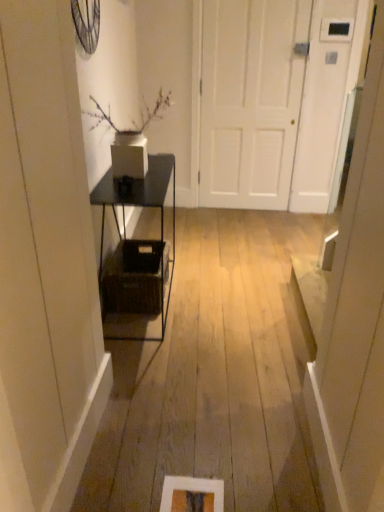
Describe the element at coordinates (250, 100) in the screenshot. I see `white matte door at center` at that location.

Image resolution: width=384 pixels, height=512 pixels. I want to click on black metal shelf at center, so pos(141,207).

From a real-world perspective, is brown woven basket at center located beneath white matte door at center?

Yes, from a real-world perspective, brown woven basket at center is under white matte door at center.

Is the position of brown woven basket at center more distant than that of white matte door at center?

No, brown woven basket at center is in front of white matte door at center.

Are brown woven basket at center and white matte door at center far apart?

brown woven basket at center is positioned a significant distance from white matte door at center.

Considering the relative sizes of white matte door at center and brown woven basket at center in the image provided, is white matte door at center wider than brown woven basket at center?

Incorrect, the width of white matte door at center does not surpass that of brown woven basket at center.

Is the surface of white matte door at center in direct contact with brown woven basket at center?

No, white matte door at center is not in contact with brown woven basket at center.

Is brown woven basket at center located within white matte door at center?

Actually, brown woven basket at center is outside white matte door at center.

In the scene shown: Between black metal shelf at center and brown woven basket at center, which one is positioned behind?

brown woven basket at center.

From the image's perspective, who appears lower, black metal shelf at center or brown woven basket at center?

brown woven basket at center.

Does black metal shelf at center have a smaller size compared to brown woven basket at center?

No, black metal shelf at center is not smaller than brown woven basket at center.

Is brown woven basket at center far from black metal shelf at center?

No, brown woven basket at center is in close proximity to black metal shelf at center.

Looking at the image, does brown woven basket at center seem bigger or smaller compared to black metal shelf at center?

brown woven basket at center is smaller than black metal shelf at center.

Is brown woven basket at center facing away from black metal shelf at center?

Yes, brown woven basket at center is facing away from black metal shelf at center.

Locate an element on the screen. Image resolution: width=384 pixels, height=512 pixels. basket behind the black metal shelf at center is located at coordinates (135, 277).

Considering the sizes of objects white matte door at center and black metal shelf at center in the image provided, who is shorter, white matte door at center or black metal shelf at center?

black metal shelf at center is shorter.

Is white matte door at center to the left or to the right of black metal shelf at center in the image?

In the image, white matte door at center appears on the right side of black metal shelf at center.

Choose the correct answer: Is white matte door at center inside black metal shelf at center or outside it?

white matte door at center lies outside black metal shelf at center.

Could you tell me if white matte door at center is facing black metal shelf at center?

Yes, white matte door at center faces towards black metal shelf at center.

Consider the image. Which of these two, black metal shelf at center or white matte door at center, is wider?

black metal shelf at center.

From a real-world perspective, which object rests below the other?

black metal shelf at center.

Can white matte door at center be found inside black metal shelf at center?

No, white matte door at center is located outside of black metal shelf at center.

This screenshot has height=512, width=384. In order to click on door above the brown woven basket at center (from a real-world perspective) in this screenshot , I will do `click(250, 100)`.

Where is `basket in front of the white matte door at center`? basket in front of the white matte door at center is located at coordinates (135, 277).

Which object lies further to the anchor point brown woven basket at center, black metal shelf at center or white matte door at center?

Based on the image, white matte door at center appears to be further to brown woven basket at center.

Based on their spatial positions, is black metal shelf at center or brown woven basket at center further from white matte door at center?

Among the two, brown woven basket at center is located further to white matte door at center.

From the image, which object appears to be farther from black metal shelf at center, brown woven basket at center or white matte door at center?

Among the two, white matte door at center is located further to black metal shelf at center.

When comparing their distances from brown woven basket at center, does white matte door at center or black metal shelf at center seem further?

Among the two, white matte door at center is located further to brown woven basket at center.

Based on their spatial positions, is white matte door at center or brown woven basket at center closer to black metal shelf at center?

Among the two, brown woven basket at center is located nearer to black metal shelf at center.

Which object lies nearer to the anchor point white matte door at center, brown woven basket at center or black metal shelf at center?

black metal shelf at center lies closer to white matte door at center than the other object.

At what (x,y) coordinates should I click in order to perform the action: click on table between white matte door at center and brown woven basket at center in the up-down direction. Please return your answer as a coordinate pair (x, y). The width and height of the screenshot is (384, 512). Looking at the image, I should click on (141, 207).